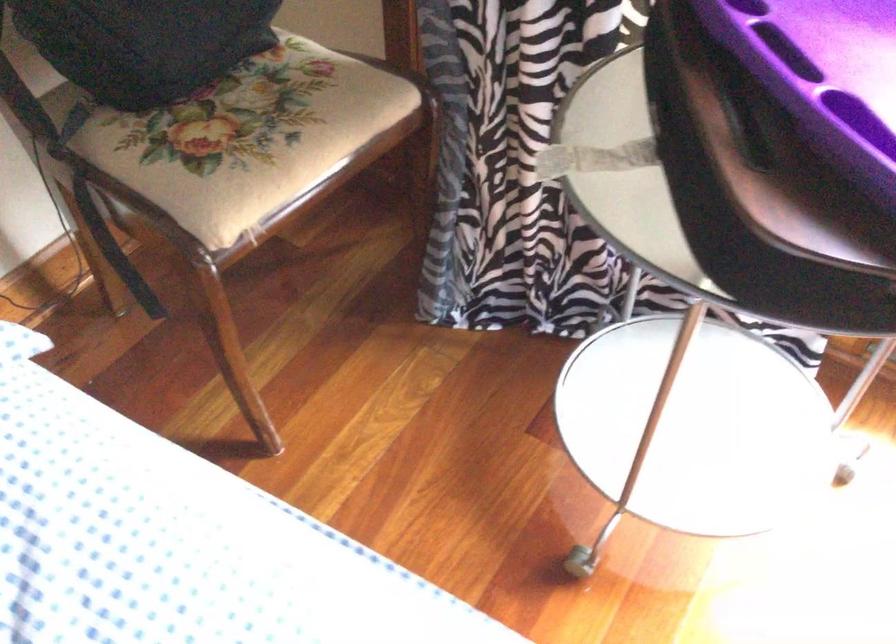
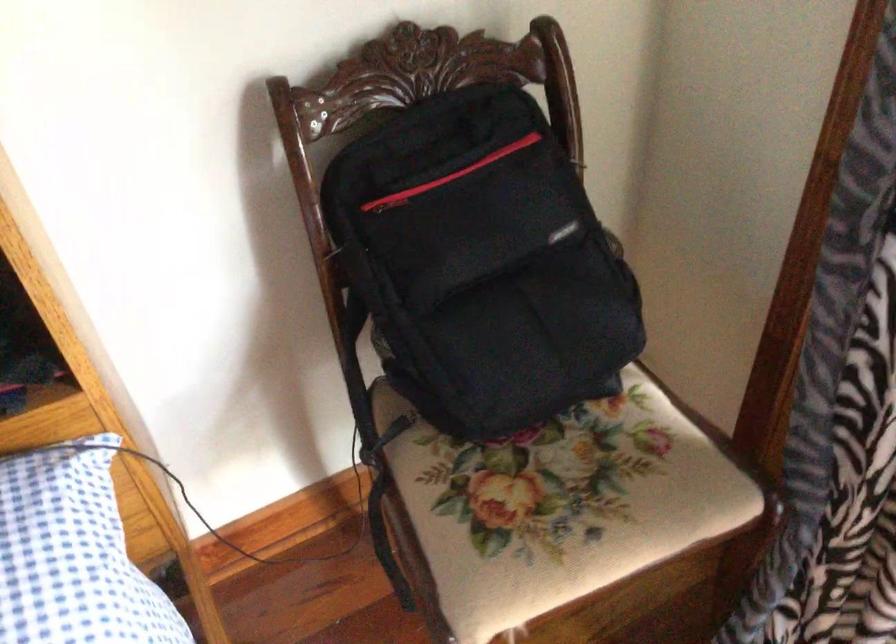
Which direction would the cameraman need to move to produce the second image?

The movement direction of the cameraman is left, forward.